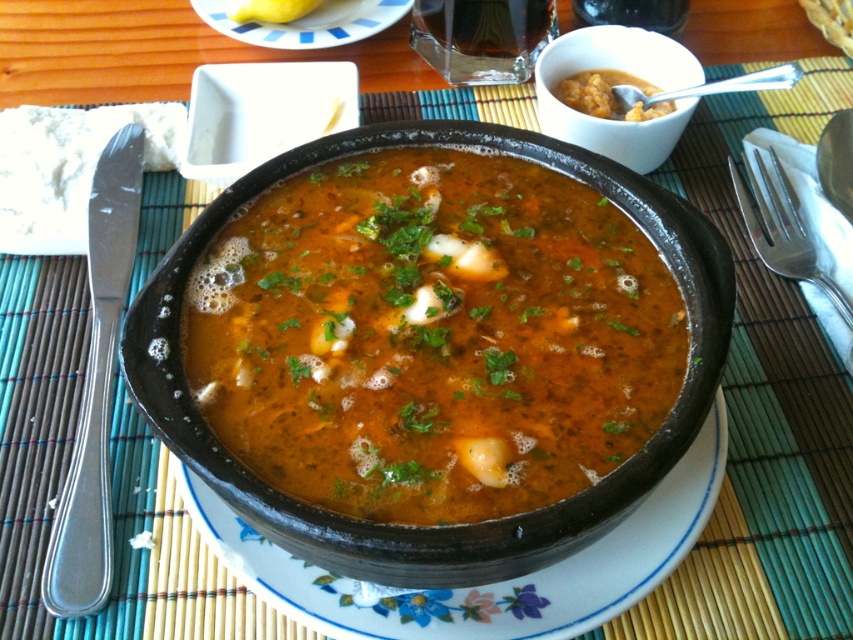
You are a diner who wants to reach for the satin silver knife at left to stir the brown matte soup at upper center. Can you easily reach the knife without moving your hand past the soup?

The satin silver knife at left is located below the brown matte soup at upper center, so you can easily reach the knife without moving your hand past the soup.

You are setting up a dinner table and have a brown matte soup at center and a white matte bowl at upper right. Which object has a greater width?

The brown matte soup at center has a greater width than the white matte bowl at upper right.

You are a chef arranging a dining table. You have a satin silver knife at left and a brown matte soup at upper center. Which object is taller when viewed from above?

The satin silver knife at left is taller than the brown matte soup at upper center according to the description.